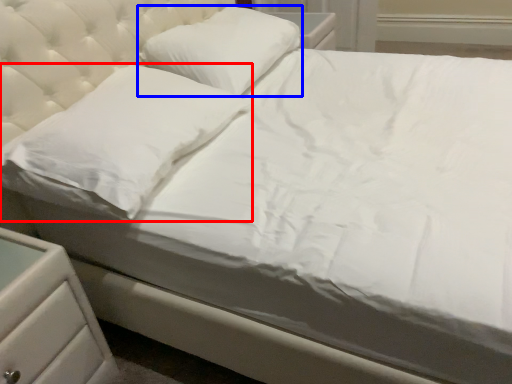
Question: Which point is closer to the camera, pillow (highlighted by a red box) or pillow (highlighted by a blue box)?

Choices:
 (A) pillow
 (B) pillow

Answer: (A)